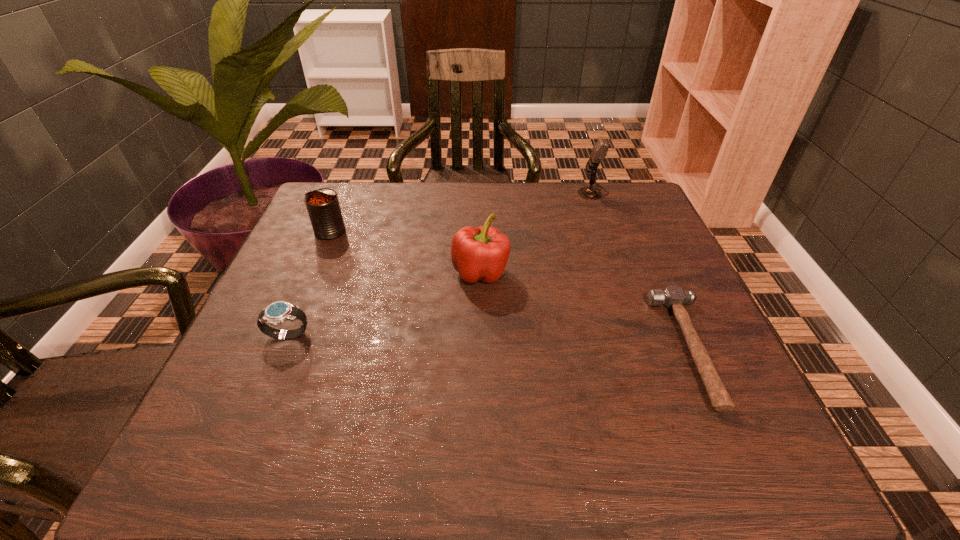
You are a GUI agent. You are given a task and a screenshot of the screen. Output one action in this format:
    pyautogui.click(x=<x>, y=<y>)
    Task: Click on the tallest object
    The image size is (960, 540).
    Given the screenshot: What is the action you would take?
    pyautogui.click(x=600, y=149)

Locate an element on the screen. The image size is (960, 540). microphone is located at coordinates (600, 149).

The image size is (960, 540). Identify the location of can. (323, 207).

Locate an element on the screen. Image resolution: width=960 pixels, height=540 pixels. bell pepper is located at coordinates (481, 253).

You are a GUI agent. You are given a task and a screenshot of the screen. Output one action in this format:
    pyautogui.click(x=<x>, y=<y>)
    Task: Click on the third object from left to right
    This screenshot has height=540, width=960.
    Given the screenshot: What is the action you would take?
    click(x=481, y=253)

This screenshot has width=960, height=540. Find the location of `the fourth tallest object`. the fourth tallest object is located at coordinates (278, 312).

Identify the location of the shortest object. (673, 297).

Where is `vacant space located 0.360m on the front-facing side of the tallest object`? vacant space located 0.360m on the front-facing side of the tallest object is located at coordinates point(452,192).

You are a GUI agent. You are given a task and a screenshot of the screen. Output one action in this format:
    pyautogui.click(x=<x>, y=<y>)
    Task: Click on the free space located 0.120m on the front-facing side of the tallest object
    Image resolution: width=960 pixels, height=540 pixels.
    Given the screenshot: What is the action you would take?
    pyautogui.click(x=536, y=192)

I want to click on vacant area situated on the front-facing side of the tallest object, so click(x=500, y=192).